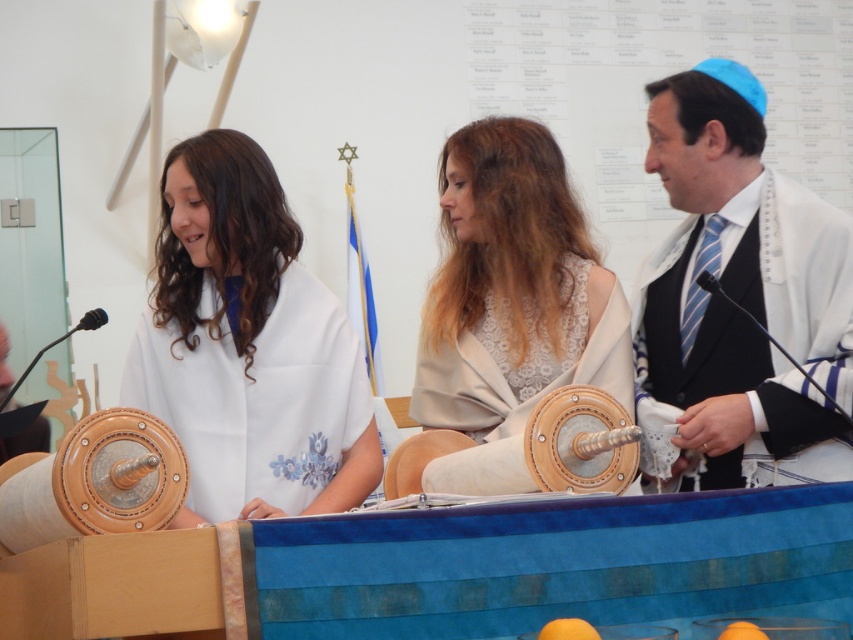
What is the position of the lace fabric shawl at center in the image?

The lace fabric shawl at center is located at point coordinates of 0.472 on the x axis and 0.600 on the y axis.

You are attending a Jewish ceremony and notice two items on the table. The lace fabric shawl at center and the white textured robe at right. Which item is positioned lower on the table?

The lace fabric shawl at center is below the white textured robe at right, so it is positioned lower on the table.

You are a photographer at the event and want to capture a photo of both the white matte shawl at center and the white textured robe at right in the same frame. The camera you have can only focus on objects within a 1 meter range. Will both items fit within the camera focus range?

The distance between the white matte shawl at center and the white textured robe at right is 99.09 centimeters, which is just under 1 meter. Therefore, both items will fit within the camera focus range.